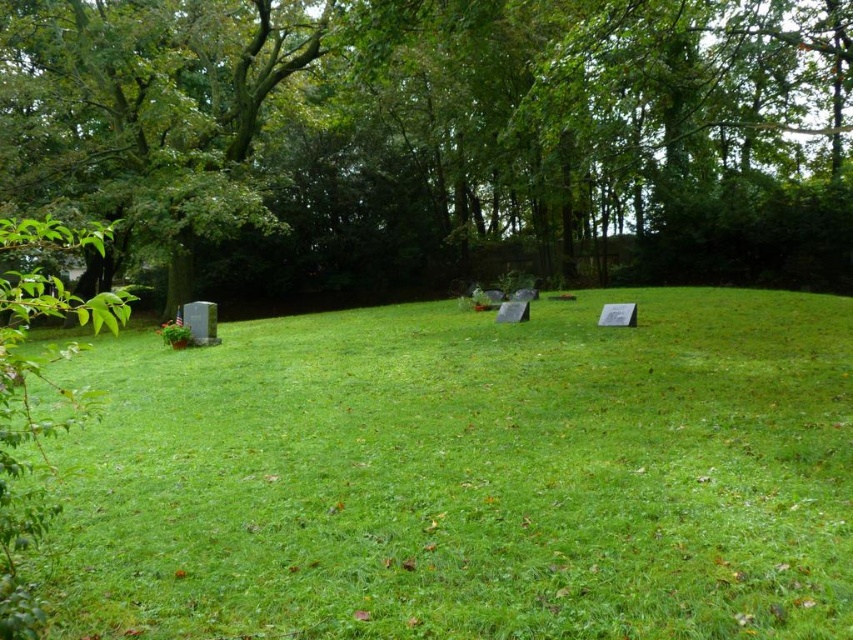
Question: Can you confirm if green grass at center is positioned to the left of green leafy tree at upper left?

Choices:
 (A) yes
 (B) no

Answer: (A)

Question: Among these points, which one is farthest from the camera?

Choices:
 (A) (317, 228)
 (B) (677, 624)

Answer: (A)

Question: In this image, where is green grass at center located relative to green leafy tree at upper left?

Choices:
 (A) right
 (B) left

Answer: (B)

Question: Which point is farther to the camera?

Choices:
 (A) (190, 186)
 (B) (405, 348)

Answer: (A)

Question: Among these objects, which one is nearest to the camera?

Choices:
 (A) green grass at center
 (B) green leafy tree at upper left

Answer: (A)

Question: Is green grass at center in front of green leafy tree at upper left?

Choices:
 (A) no
 (B) yes

Answer: (B)